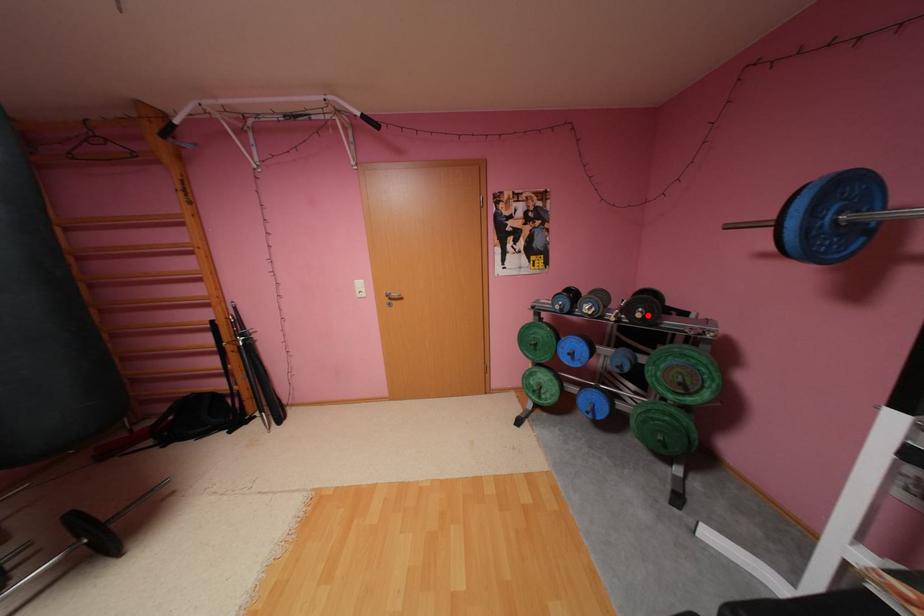
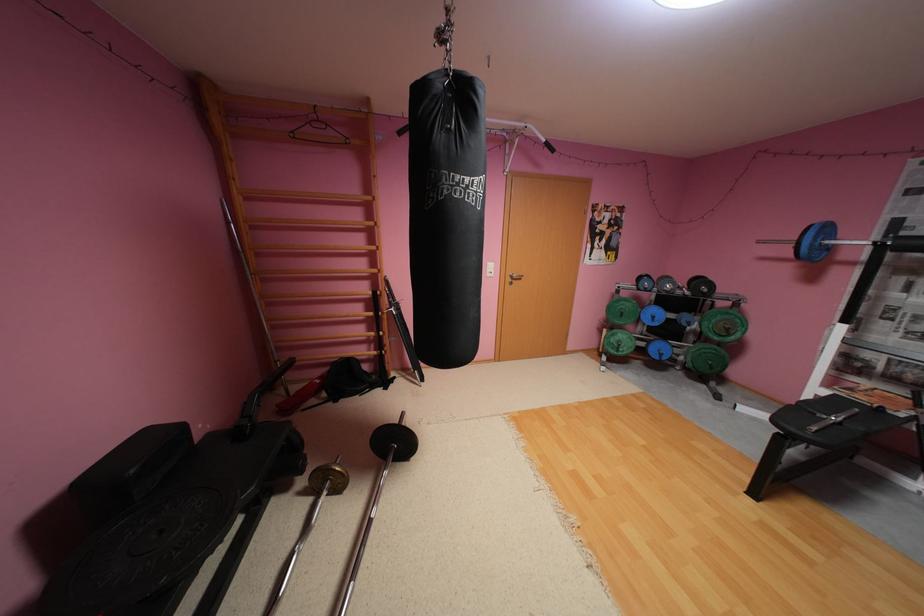
Find the pixel in the second image that matches the highlighted location in the first image.

(714, 291)